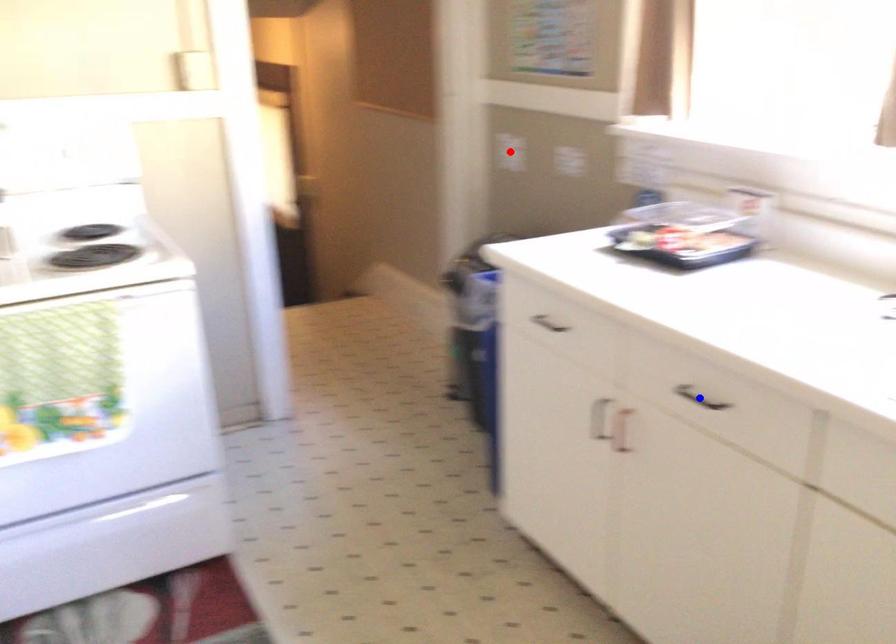
Question: In the image, two points are highlighted. Which point is nearer to the camera? Reply with the corresponding letter.

Choices:
 (A) blue point
 (B) red point

Answer: (A)